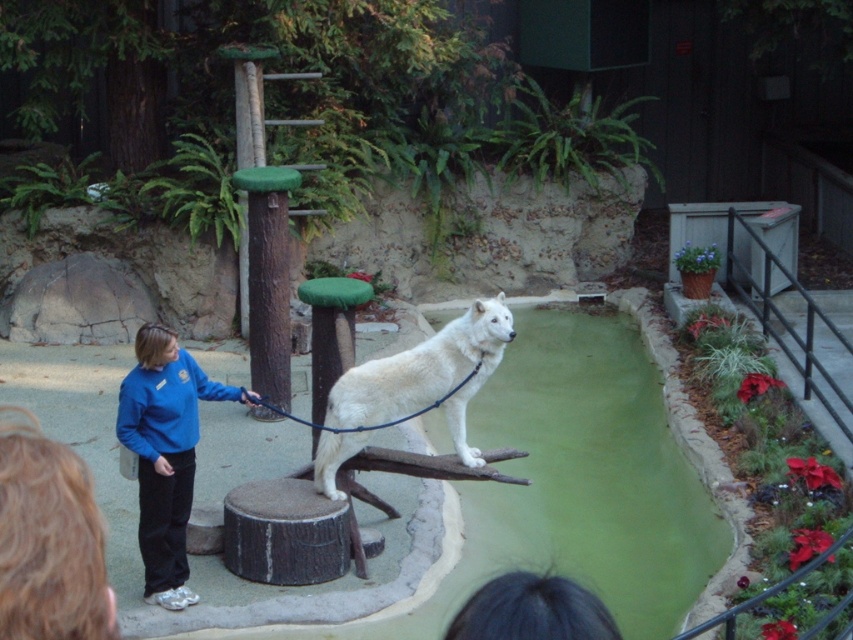
Question: Which of the following is the farthest from the observer?

Choices:
 (A) (329, 390)
 (B) (183, 364)

Answer: (A)

Question: Is blue fleece jacket at center positioned behind white fur dog at center?

Choices:
 (A) no
 (B) yes

Answer: (A)

Question: Which of the following is the closest to the observer?

Choices:
 (A) blue fleece jacket at center
 (B) white fur dog at center

Answer: (A)

Question: Can you confirm if blue fleece jacket at center is positioned to the left of white fur dog at center?

Choices:
 (A) no
 (B) yes

Answer: (B)

Question: Is blue fleece jacket at center to the right of white fur dog at center from the viewer's perspective?

Choices:
 (A) yes
 (B) no

Answer: (B)